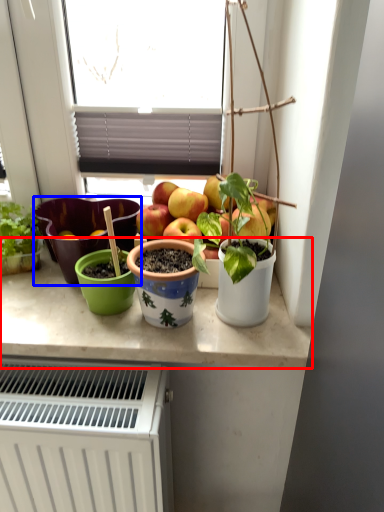
Question: Which object appears closest to the camera in this image, counter top (highlighted by a red box) or flowerpot (highlighted by a blue box)?

Choices:
 (A) counter top
 (B) flowerpot

Answer: (A)